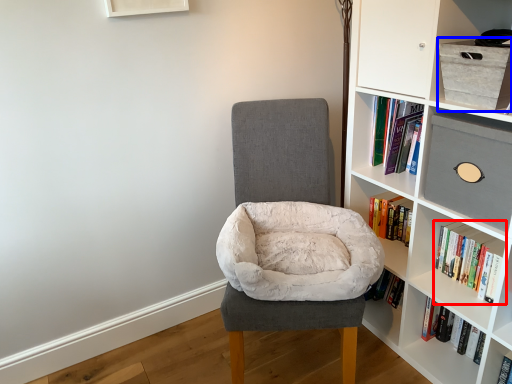
Question: Which point is closer to the camera, book (highlighted by a red box) or cabinet (highlighted by a blue box)?

Choices:
 (A) book
 (B) cabinet

Answer: (B)